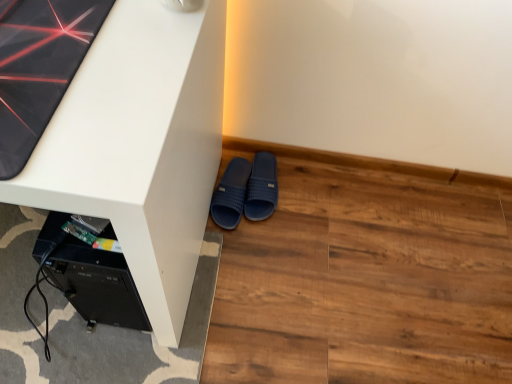
In order to face navy blue rubber slippers at lower center, the 2th footwear viewed from the left, should I rotate leftwards or rightwards?

A 1.331 degree turn to the right will do.

Describe the element at coordinates (140, 146) in the screenshot. I see `white matte desk at center` at that location.

Describe the element at coordinates (246, 191) in the screenshot. The image size is (512, 384). I see `dark blue rubber slippers at lower center, which ranks as the first footwear in left-to-right order` at that location.

What do you see at coordinates (365, 276) in the screenshot?
I see `brown wood flooring at lower right` at bounding box center [365, 276].

Locate an element on the screen. Image resolution: width=512 pixels, height=384 pixels. navy blue rubber slippers at lower center, the 2th footwear viewed from the left is located at coordinates (262, 188).

Considering the sizes of objects brown wood flooring at lower right and navy blue rubber slippers at lower center, arranged as the 1th footwear when viewed from the right, in the image provided, who is bigger, brown wood flooring at lower right or navy blue rubber slippers at lower center, arranged as the 1th footwear when viewed from the right,?

brown wood flooring at lower right.

How different are the orientations of brown wood flooring at lower right and navy blue rubber slippers at lower center, the 2th footwear viewed from the left, in degrees?

brown wood flooring at lower right and navy blue rubber slippers at lower center, the 2th footwear viewed from the left, are facing 91 degrees away from each other.

From a real-world perspective, is brown wood flooring at lower right on top of navy blue rubber slippers at lower center, arranged as the 1th footwear when viewed from the right?

No, from a real-world perspective, brown wood flooring at lower right is not over navy blue rubber slippers at lower center, arranged as the 1th footwear when viewed from the right

Considering the points (318, 335) and (255, 215), which point is behind, point (318, 335) or point (255, 215)?

The point (255, 215) is behind.

From the image's perspective, which one is positioned lower, white matte desk at center or navy blue rubber slippers at lower center, the 2th footwear viewed from the left?

navy blue rubber slippers at lower center, the 2th footwear viewed from the left, from the image's perspective.

How much distance is there between white matte desk at center and navy blue rubber slippers at lower center, the 2th footwear viewed from the left?

white matte desk at center is 22.34 inches from navy blue rubber slippers at lower center, the 2th footwear viewed from the left.

Based on the photo, is white matte desk at center further to the viewer compared to navy blue rubber slippers at lower center, arranged as the 1th footwear when viewed from the right?

No, white matte desk at center is closer to the camera.

Is white matte desk at center taller than navy blue rubber slippers at lower center, arranged as the 1th footwear when viewed from the right?

Indeed, white matte desk at center has a greater height compared to navy blue rubber slippers at lower center, arranged as the 1th footwear when viewed from the right.

From the image's perspective, relative to navy blue rubber slippers at lower center, the 2th footwear viewed from the left, is dark blue rubber slippers at lower center, which ranks as the first footwear in left-to-right order, above or below?

dark blue rubber slippers at lower center, which ranks as the first footwear in left-to-right order, is situated lower than navy blue rubber slippers at lower center, the 2th footwear viewed from the left, in the image.

Could you tell me if dark blue rubber slippers at lower center, which is counted as the 2th footwear, starting from the right, is facing navy blue rubber slippers at lower center, arranged as the 1th footwear when viewed from the right?

No.

In terms of width, does dark blue rubber slippers at lower center, which is counted as the 2th footwear, starting from the right, look wider or thinner when compared to navy blue rubber slippers at lower center, the 2th footwear viewed from the left?

Clearly, dark blue rubber slippers at lower center, which is counted as the 2th footwear, starting from the right, has more width compared to navy blue rubber slippers at lower center, the 2th footwear viewed from the left.

Between point (256, 217) and point (267, 202), which one is positioned in front?

The point (256, 217) is closer to the camera.

Is dark blue rubber slippers at lower center, which is counted as the 2th footwear, starting from the right, wider or thinner than white matte desk at center?

Considering their sizes, dark blue rubber slippers at lower center, which is counted as the 2th footwear, starting from the right, looks slimmer than white matte desk at center.

Does point (238, 161) appear closer or farther from the camera than point (134, 155)?

Point (238, 161) is farther from the camera than point (134, 155).

Do you think dark blue rubber slippers at lower center, which ranks as the first footwear in left-to-right order, is within white matte desk at center, or outside of it?

dark blue rubber slippers at lower center, which ranks as the first footwear in left-to-right order, cannot be found inside white matte desk at center.

From the image's perspective, would you say dark blue rubber slippers at lower center, which ranks as the first footwear in left-to-right order, is shown under white matte desk at center?

Yes.

Is point (475, 259) positioned in front of point (175, 27)?

No, (475, 259) is behind (175, 27).

Can you confirm if brown wood flooring at lower right is taller than white matte desk at center?

No.

Considering the sizes of objects brown wood flooring at lower right and white matte desk at center in the image provided, who is bigger, brown wood flooring at lower right or white matte desk at center?

white matte desk at center.

From a real-world perspective, is brown wood flooring at lower right over white matte desk at center?

No, from a real-world perspective, brown wood flooring at lower right is not above white matte desk at center.

At what (x,y) coordinates should I click in order to perform the action: click on the 2nd footwear to the right of the white matte desk at center, starting your count from the anchor. Please return your answer as a coordinate pair (x, y). This screenshot has height=384, width=512. Looking at the image, I should click on coord(262,188).

Based on the photo, from the image's perspective, between navy blue rubber slippers at lower center, arranged as the 1th footwear when viewed from the right, and white matte desk at center, which one is located above?

white matte desk at center is shown above in the image.

Are navy blue rubber slippers at lower center, the 2th footwear viewed from the left, and white matte desk at center located far from each other?

That's not correct — navy blue rubber slippers at lower center, the 2th footwear viewed from the left, is a little close to white matte desk at center.

From a real-world perspective, does navy blue rubber slippers at lower center, arranged as the 1th footwear when viewed from the right, sit lower than white matte desk at center?

Yes, from a real-world perspective, navy blue rubber slippers at lower center, arranged as the 1th footwear when viewed from the right, is beneath white matte desk at center.

Is white matte desk at center thinner than dark blue rubber slippers at lower center, which is counted as the 2th footwear, starting from the right?

No, white matte desk at center is not thinner than dark blue rubber slippers at lower center, which is counted as the 2th footwear, starting from the right.

Considering the relative positions of white matte desk at center and dark blue rubber slippers at lower center, which ranks as the first footwear in left-to-right order, in the image provided, is white matte desk at center behind dark blue rubber slippers at lower center, which ranks as the first footwear in left-to-right order,?

No, it is in front of dark blue rubber slippers at lower center, which ranks as the first footwear in left-to-right order.

Is white matte desk at center located outside dark blue rubber slippers at lower center, which ranks as the first footwear in left-to-right order?

Yes.

Is white matte desk at center oriented away from dark blue rubber slippers at lower center, which ranks as the first footwear in left-to-right order?

No, white matte desk at center's orientation is not away from dark blue rubber slippers at lower center, which ranks as the first footwear in left-to-right order.

Starting from the brown wood flooring at lower right, which footwear is the 1st one to the left? Please provide its 2D coordinates.

[(262, 188)]

The height and width of the screenshot is (384, 512). In order to click on the 2nd footwear located beneath the white matte desk at center (from a real-world perspective) in this screenshot , I will do `click(262, 188)`.

Based on their spatial positions, is navy blue rubber slippers at lower center, the 2th footwear viewed from the left, or dark blue rubber slippers at lower center, which ranks as the first footwear in left-to-right order, closer to white matte desk at center?

Among the two, dark blue rubber slippers at lower center, which ranks as the first footwear in left-to-right order, is located nearer to white matte desk at center.

When comparing their distances from dark blue rubber slippers at lower center, which ranks as the first footwear in left-to-right order, does brown wood flooring at lower right or white matte desk at center seem further?

white matte desk at center is positioned further to the anchor dark blue rubber slippers at lower center, which ranks as the first footwear in left-to-right order.

When comparing their distances from dark blue rubber slippers at lower center, which ranks as the first footwear in left-to-right order, does white matte desk at center or brown wood flooring at lower right seem closer?

The object closer to dark blue rubber slippers at lower center, which ranks as the first footwear in left-to-right order, is brown wood flooring at lower right.

Based on their spatial positions, is brown wood flooring at lower right or navy blue rubber slippers at lower center, arranged as the 1th footwear when viewed from the right, further from dark blue rubber slippers at lower center, which ranks as the first footwear in left-to-right order?

brown wood flooring at lower right is positioned further to the anchor dark blue rubber slippers at lower center, which ranks as the first footwear in left-to-right order.

Considering their positions, is dark blue rubber slippers at lower center, which ranks as the first footwear in left-to-right order, positioned closer to navy blue rubber slippers at lower center, the 2th footwear viewed from the left, than white matte desk at center?

dark blue rubber slippers at lower center, which ranks as the first footwear in left-to-right order, is positioned closer to the anchor navy blue rubber slippers at lower center, the 2th footwear viewed from the left.

Considering their positions, is brown wood flooring at lower right positioned closer to white matte desk at center than dark blue rubber slippers at lower center, which is counted as the 2th footwear, starting from the right?

dark blue rubber slippers at lower center, which is counted as the 2th footwear, starting from the right.

Which object lies further to the anchor point white matte desk at center, brown wood flooring at lower right or navy blue rubber slippers at lower center, the 2th footwear viewed from the left?

navy blue rubber slippers at lower center, the 2th footwear viewed from the left.

Looking at the image, which one is located further to brown wood flooring at lower right, white matte desk at center or navy blue rubber slippers at lower center, the 2th footwear viewed from the left?

white matte desk at center is positioned further to the anchor brown wood flooring at lower right.

This screenshot has height=384, width=512. In order to click on footwear between white matte desk at center and navy blue rubber slippers at lower center, the 2th footwear viewed from the left, from front to back in this screenshot , I will do `click(246, 191)`.

This screenshot has width=512, height=384. What are the coordinates of `hardwood between white matte desk at center and navy blue rubber slippers at lower center, the 2th footwear viewed from the left, along the z-axis` in the screenshot? It's located at (365, 276).

Locate an element on the screen. Image resolution: width=512 pixels, height=384 pixels. hardwood between white matte desk at center and dark blue rubber slippers at lower center, which ranks as the first footwear in left-to-right order, along the z-axis is located at coordinates (365, 276).

The width and height of the screenshot is (512, 384). What are the coordinates of `footwear between navy blue rubber slippers at lower center, arranged as the 1th footwear when viewed from the right, and brown wood flooring at lower right vertically` in the screenshot? It's located at 246,191.